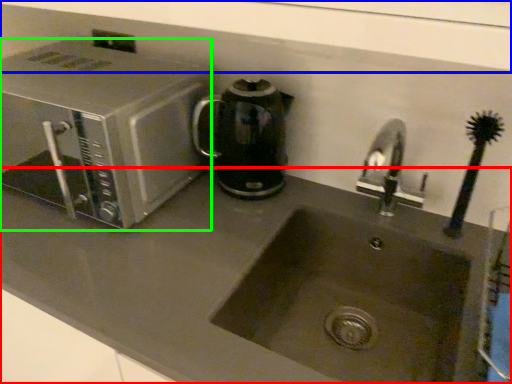
Question: Which object is the closest to the counter top (highlighted by a red box)? Choose among these: window sill (highlighted by a blue box) or microwave oven (highlighted by a green box).

Choices:
 (A) window sill
 (B) microwave oven

Answer: (B)